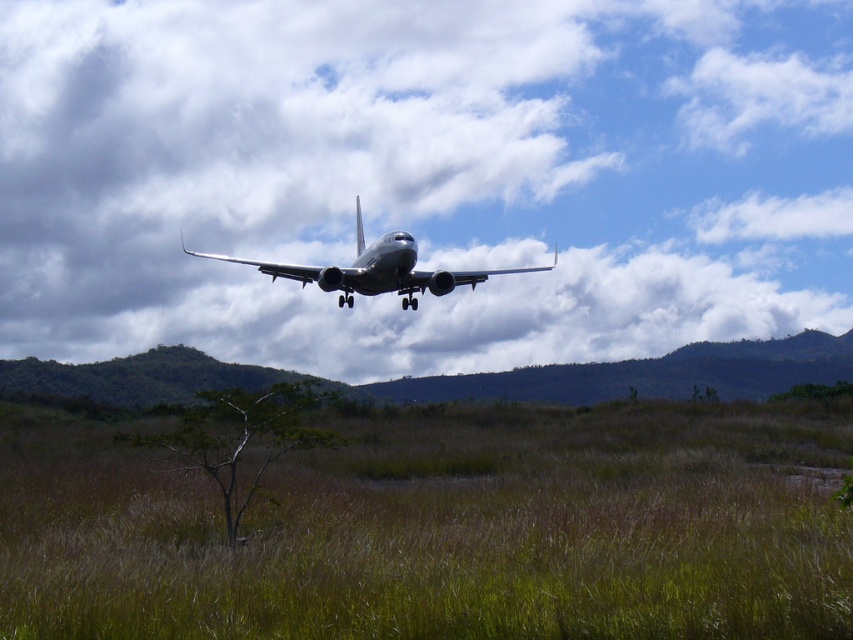
Looking at this image, does white fluffy cloud at upper center come in front of metallic gray airplane at center?

No.

Looking at this image, which is more to the right, white fluffy cloud at upper center or metallic gray airplane at center?

white fluffy cloud at upper center is more to the right.

Is point (743, 147) closer to camera compared to point (387, 243)?

No, it is not.

This screenshot has height=640, width=853. What are the coordinates of `white fluffy cloud at upper center` in the screenshot? It's located at (422, 177).

Is green matte tree at center to the left of metallic gray airplane at center from the viewer's perspective?

Incorrect, green matte tree at center is not on the left side of metallic gray airplane at center.

Based on the photo, between green matte tree at center and metallic gray airplane at center, which one appears on the right side from the viewer's perspective?

green matte tree at center is more to the right.

Who is more distant from viewer, (x=247, y=449) or (x=465, y=282)?

The point (x=465, y=282) is behind.

Find the location of a particular element. green matte tree at center is located at coordinates (241, 438).

Is brown dry grass at center smaller than metallic gray airplane at center?

Correct, brown dry grass at center occupies less space than metallic gray airplane at center.

Is brown dry grass at center thinner than metallic gray airplane at center?

In fact, brown dry grass at center might be wider than metallic gray airplane at center.

Between point (664, 506) and point (250, 260), which one is positioned in front?

Positioned in front is point (664, 506).

I want to click on brown dry grass at center, so click(x=442, y=529).